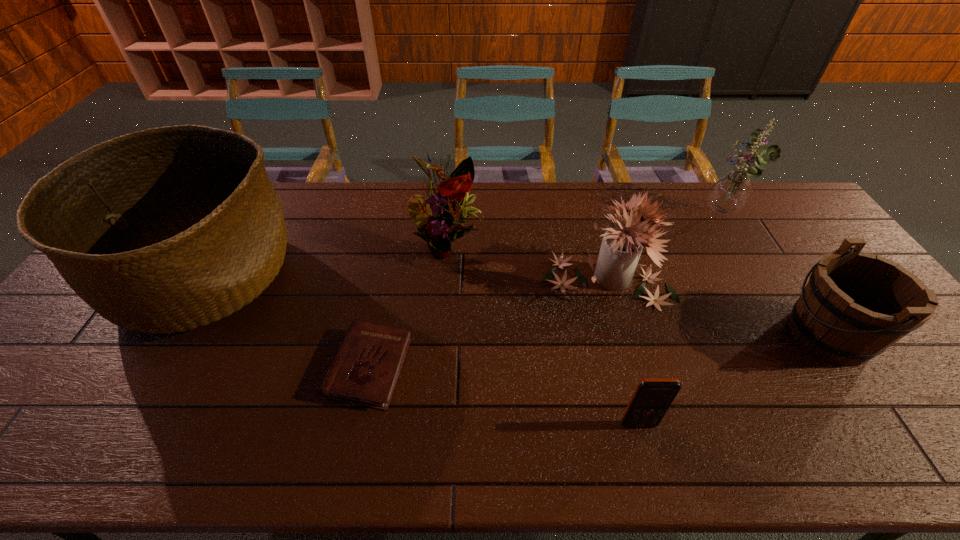
Locate which bouquet is the third closest to the basket. Please provide its 2D coordinates. Your answer should be formatted as a tuple, i.e. [(x, y)], where the tuple contains the x and y coordinates of a point satisfying the conditions above.

[(730, 192)]

The image size is (960, 540). I want to click on bouquet that is the nearest to the rightmost bouquet, so click(x=621, y=247).

At what (x,y) coordinates should I click in order to perform the action: click on free spot that satisfies the following two spatial constraints: 1. on the front-facing side of the rightmost bouquet; 2. on the front side of the leftmost object. Please return your answer as a coordinate pair (x, y). Looking at the image, I should click on (762, 277).